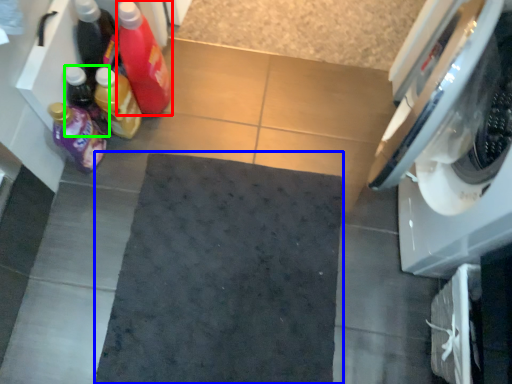
Question: Estimate the real-world distances between objects in this image. Which object is closer to bottle (highlighted by a red box), bath mat (highlighted by a blue box) or bottle (highlighted by a green box)?

Choices:
 (A) bath mat
 (B) bottle

Answer: (B)